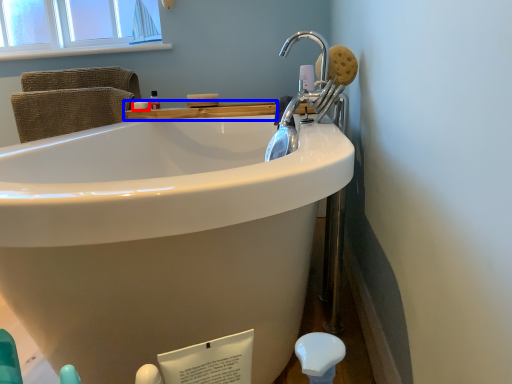
Question: Which of the following is the closest to the observer, soap (highlighted by a red box) or counter top (highlighted by a blue box)?

Choices:
 (A) soap
 (B) counter top

Answer: (B)